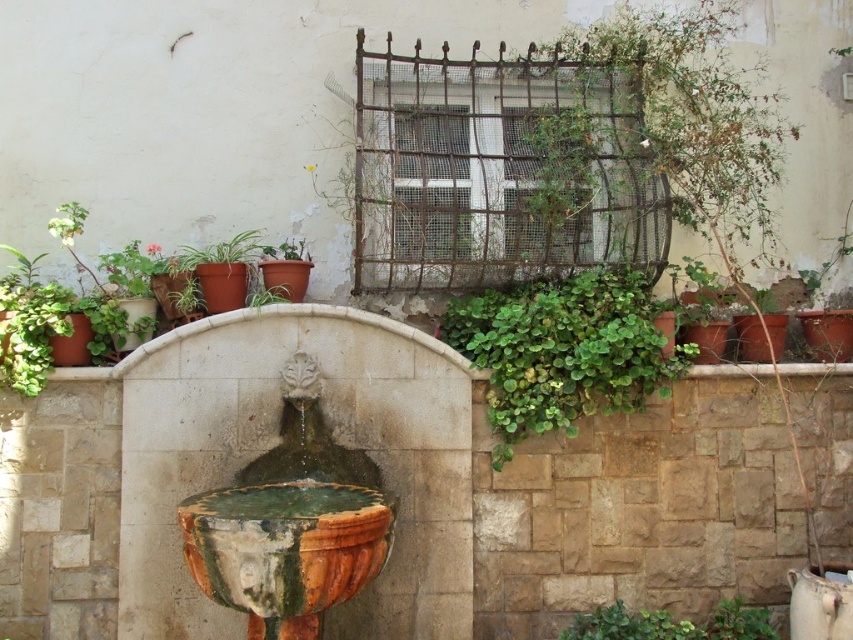
Question: Can you confirm if matte terracotta pot at center is bigger than green leafy plant at lower right?

Choices:
 (A) yes
 (B) no

Answer: (A)

Question: Is green glazed stone fountain at center in front of matte terracotta pot at center?

Choices:
 (A) no
 (B) yes

Answer: (B)

Question: Is matte terracotta pot at center further to the viewer compared to green leafy plant at lower right?

Choices:
 (A) no
 (B) yes

Answer: (B)

Question: Which point is closer to the camera taking this photo?

Choices:
 (A) (155, 248)
 (B) (689, 355)

Answer: (B)

Question: Among these objects, which one is farthest from the camera?

Choices:
 (A) green glazed stone fountain at center
 (B) green matte leafy plant at upper left
 (C) green leafy plant at lower right
 (D) green leafy plant at lower center

Answer: (B)

Question: Among these points, which one is farthest from the camera?

Choices:
 (A) (80, 218)
 (B) (146, 257)
 (C) (631, 627)
 (D) (515, 422)

Answer: (B)